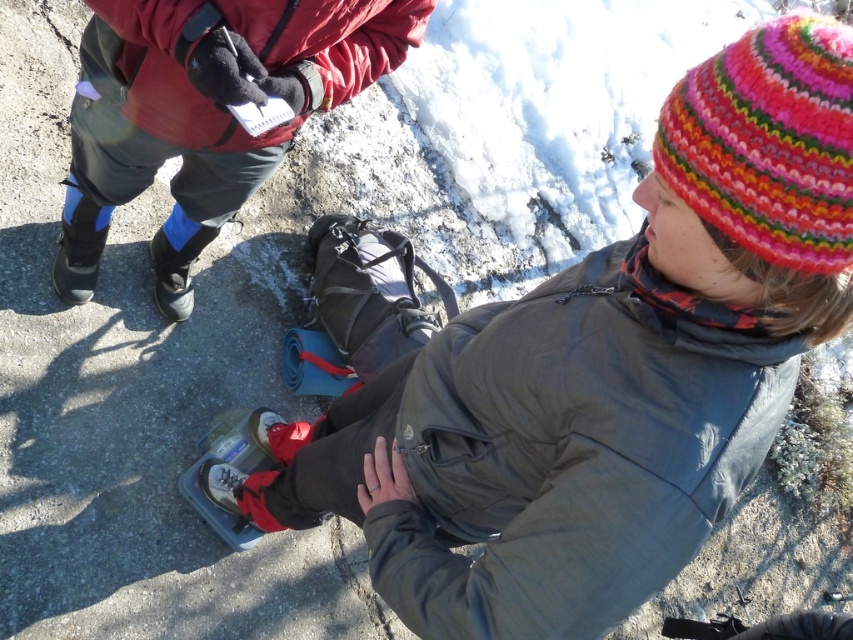
Which of these two, matte red jacket at upper left or black rubber ski boot at upper left, stands shorter?

Standing shorter between the two is black rubber ski boot at upper left.

The image size is (853, 640). Find the location of `matte red jacket at upper left`. matte red jacket at upper left is located at coordinates (206, 104).

Between knitted woolen hat at upper right and black rubber ski boot at upper left, which one has less height?

With less height is black rubber ski boot at upper left.

Measure the distance between knitted woolen hat at upper right and black rubber ski boot at upper left.

A distance of 6.01 feet exists between knitted woolen hat at upper right and black rubber ski boot at upper left.

Which is in front, point (846, 268) or point (173, 253)?

Point (846, 268)

Locate an element on the screen. knitted woolen hat at upper right is located at coordinates (769, 141).

Who is lower down, red fleece jacket at upper left or black rubber ski boot at upper left?

Positioned lower is black rubber ski boot at upper left.

Does red fleece jacket at upper left have a greater width compared to black rubber ski boot at upper left?

Indeed, red fleece jacket at upper left has a greater width compared to black rubber ski boot at upper left.

Who is more distant from viewer, (135, 80) or (154, 236)?

Positioned behind is point (154, 236).

At what (x,y) coordinates should I click in order to perform the action: click on red fleece jacket at upper left. Please return your answer as a coordinate pair (x, y). The height and width of the screenshot is (640, 853). Looking at the image, I should click on (167, 76).